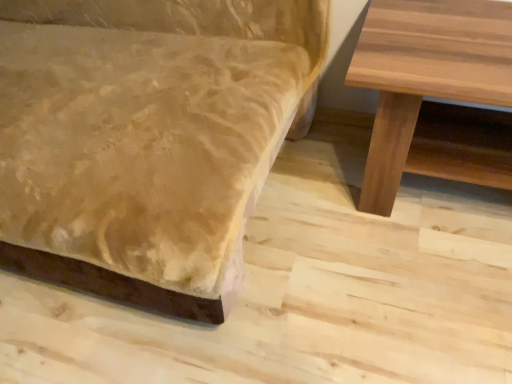
Question: Is velvet-like beige couch at lower left far away from natural wood table at right?

Choices:
 (A) no
 (B) yes

Answer: (A)

Question: Does velvet-like beige couch at lower left have a lesser height compared to natural wood table at right?

Choices:
 (A) no
 (B) yes

Answer: (A)

Question: Are velvet-like beige couch at lower left and natural wood table at right beside each other?

Choices:
 (A) yes
 (B) no

Answer: (B)

Question: Is velvet-like beige couch at lower left completely or partially outside of natural wood table at right?

Choices:
 (A) yes
 (B) no

Answer: (A)

Question: Is natural wood table at right surrounded by velvet-like beige couch at lower left?

Choices:
 (A) yes
 (B) no

Answer: (B)

Question: From a real-world perspective, is velvet-like beige couch at lower left located beneath natural wood table at right?

Choices:
 (A) no
 (B) yes

Answer: (A)

Question: Is natural wood table at right oriented away from velvet-like beige couch at lower left?

Choices:
 (A) yes
 (B) no

Answer: (B)

Question: Is velvet-like beige couch at lower left a part of natural wood table at right?

Choices:
 (A) yes
 (B) no

Answer: (B)

Question: Is natural wood table at right to the left of velvet-like beige couch at lower left from the viewer's perspective?

Choices:
 (A) yes
 (B) no

Answer: (B)

Question: Is natural wood table at right thinner than velvet-like beige couch at lower left?

Choices:
 (A) no
 (B) yes

Answer: (B)

Question: Is natural wood table at right smaller than velvet-like beige couch at lower left?

Choices:
 (A) yes
 (B) no

Answer: (A)

Question: Considering the relative sizes of natural wood table at right and velvet-like beige couch at lower left in the image provided, is natural wood table at right bigger than velvet-like beige couch at lower left?

Choices:
 (A) yes
 (B) no

Answer: (B)

Question: From a real-world perspective, relative to velvet-like beige couch at lower left, is natural wood table at right vertically above or below?

Choices:
 (A) below
 (B) above

Answer: (A)